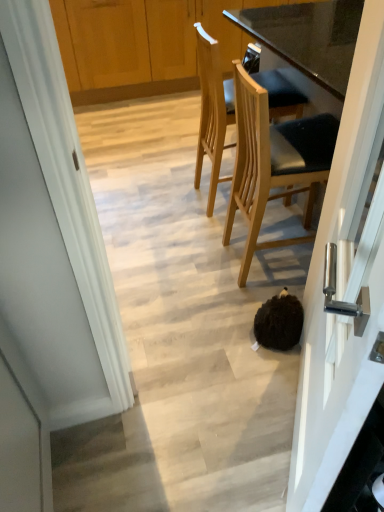
Question: From a real-world perspective, is light brown wood chair at center, which ranks as the 2th chair in back-to-front order, physically located above or below white glossy door handle at center right?

Choices:
 (A) below
 (B) above

Answer: (A)

Question: Would you say light brown wood chair at center, marked as the first chair in a front-to-back arrangement, is to the left or to the right of white glossy door handle at center right in the picture?

Choices:
 (A) left
 (B) right

Answer: (B)

Question: Which of these objects is positioned farthest from the light wood/texture chair at upper center, arranged as the first chair when viewed from the back?

Choices:
 (A) white glossy door handle at center right
 (B) light brown wood chair at center, which ranks as the 2th chair in back-to-front order
 (C) brown fuzzy ball at lower center
 (D) wooden cabinets at upper center

Answer: (D)

Question: Which object is positioned closest to the brown fuzzy ball at lower center?

Choices:
 (A) white glossy door handle at center right
 (B) light wood/texture chair at upper center, which is the 2th chair from front to back
 (C) light brown wood chair at center, which ranks as the 2th chair in back-to-front order
 (D) wooden cabinets at upper center

Answer: (C)